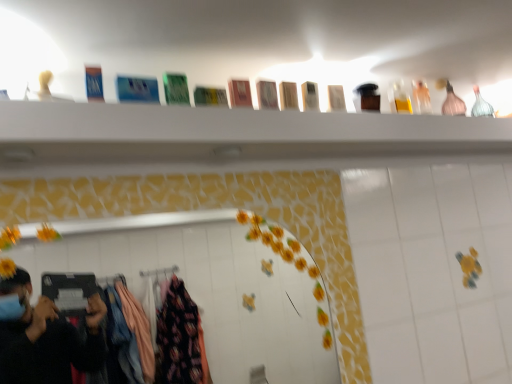
Question: Does white glossy mirror at center lie behind pink glass bottle at upper right?

Choices:
 (A) no
 (B) yes

Answer: (A)

Question: Does white glossy mirror at center come in front of pink glass bottle at upper right?

Choices:
 (A) yes
 (B) no

Answer: (A)

Question: Is white glossy mirror at center at the left side of pink glass bottle at upper right?

Choices:
 (A) no
 (B) yes

Answer: (B)

Question: Does white glossy mirror at center have a greater width compared to pink glass bottle at upper right?

Choices:
 (A) no
 (B) yes

Answer: (A)

Question: From the image's perspective, is white glossy mirror at center below pink glass bottle at upper right?

Choices:
 (A) no
 (B) yes

Answer: (B)

Question: Is white glossy mirror at center to the left or to the right of wooden boxes at upper center in the image?

Choices:
 (A) right
 (B) left

Answer: (B)

Question: Does point (138, 266) appear closer or farther from the camera than point (41, 165)?

Choices:
 (A) farther
 (B) closer

Answer: (A)

Question: From the image's perspective, relative to wooden boxes at upper center, is white glossy mirror at center above or below?

Choices:
 (A) above
 (B) below

Answer: (B)

Question: From a real-world perspective, is white glossy mirror at center above or below wooden boxes at upper center?

Choices:
 (A) below
 (B) above

Answer: (A)

Question: Considering their positions, is wooden boxes at upper center located in front of or behind white glossy mirror at center?

Choices:
 (A) front
 (B) behind

Answer: (A)

Question: Is point (442, 150) closer or farther from the camera than point (236, 355)?

Choices:
 (A) closer
 (B) farther

Answer: (A)

Question: Considering the positions of wooden boxes at upper center and white glossy mirror at center in the image, is wooden boxes at upper center bigger or smaller than white glossy mirror at center?

Choices:
 (A) big
 (B) small

Answer: (A)

Question: From a real-world perspective, is wooden boxes at upper center physically located above or below white glossy mirror at center?

Choices:
 (A) below
 (B) above

Answer: (B)

Question: Is pink glass bottle at upper right situated inside white glossy mirror at center or outside?

Choices:
 (A) outside
 (B) inside

Answer: (A)

Question: Considering the positions of pink glass bottle at upper right and white glossy mirror at center in the image, is pink glass bottle at upper right taller or shorter than white glossy mirror at center?

Choices:
 (A) tall
 (B) short

Answer: (B)